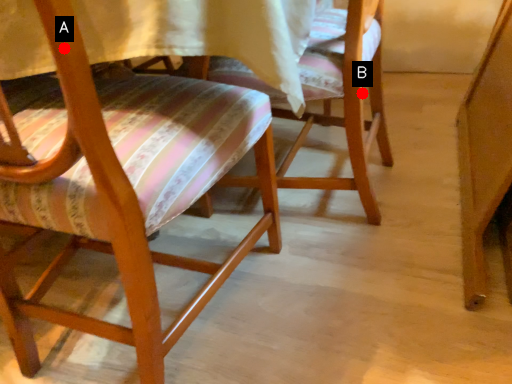
Question: Two points are circled on the image, labeled by A and B beside each circle. Which point appears closest to the camera in this image?

Choices:
 (A) A is closer
 (B) B is closer

Answer: (A)